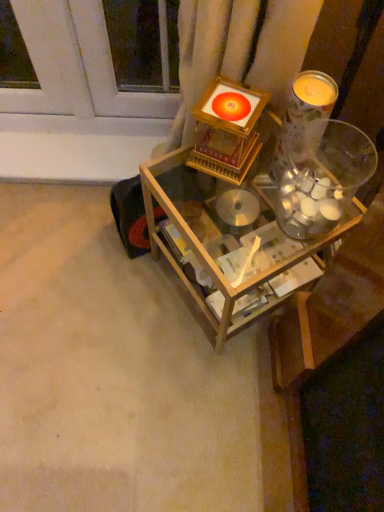
In order to click on free space to the left of wooden table at center in this screenshot , I will do `click(117, 298)`.